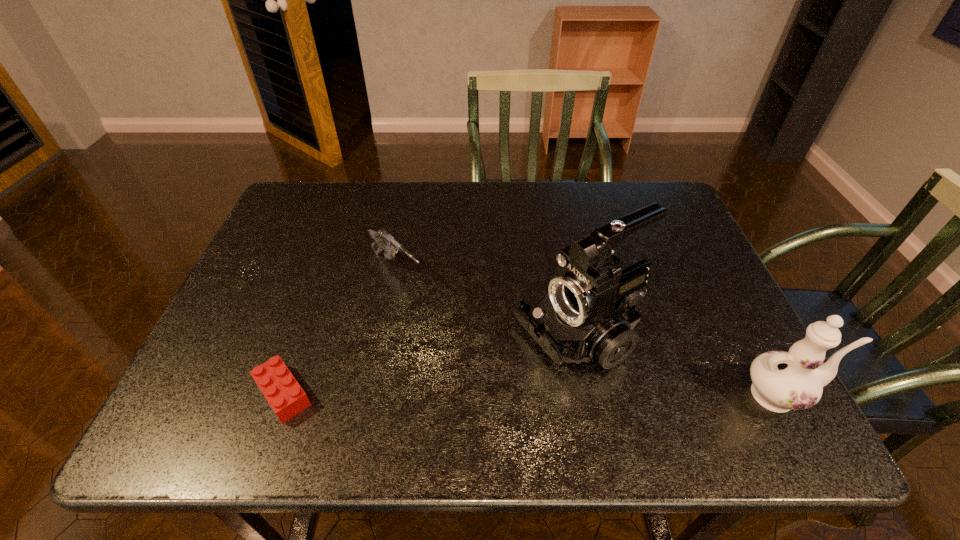
You are a GUI agent. You are given a task and a screenshot of the screen. Output one action in this format:
    pyautogui.click(x=<x>, y=<y>)
    Task: Click on the leftmost object
    
    Given the screenshot: What is the action you would take?
    pyautogui.click(x=284, y=394)

Identify the location of Lego. (284, 394).

The width and height of the screenshot is (960, 540). I want to click on chinaware, so click(782, 381).

I want to click on the rightmost object, so click(x=782, y=381).

You are a GUI agent. You are given a task and a screenshot of the screen. Output one action in this format:
    pyautogui.click(x=<x>, y=<y>)
    Task: Click on the second object from left to right
    This screenshot has height=540, width=960.
    Given the screenshot: What is the action you would take?
    pyautogui.click(x=382, y=239)

At what (x,y) coordinates should I click in order to perform the action: click on gun. Please return your answer as a coordinate pair (x, y). This screenshot has width=960, height=540. Looking at the image, I should click on (382, 239).

Where is `camcorder`? camcorder is located at coordinates (588, 313).

The width and height of the screenshot is (960, 540). I want to click on the tallest object, so click(588, 313).

Locate an element on the screen. The image size is (960, 540). free point located on the back of the shortest object is located at coordinates (324, 279).

Find the location of `free space located at the barrel of the third tallest object`. free space located at the barrel of the third tallest object is located at coordinates (468, 335).